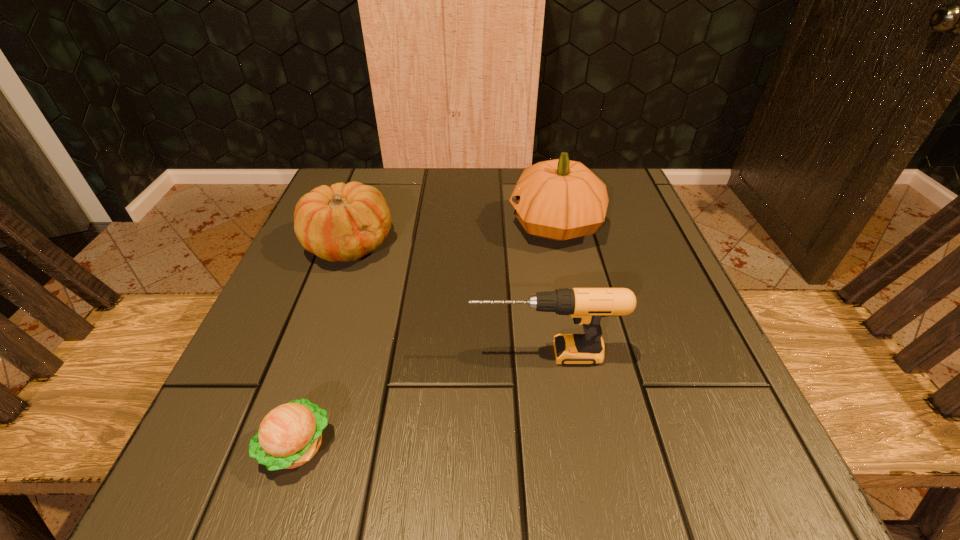
Image resolution: width=960 pixels, height=540 pixels. In order to click on free spot located on the side of the taller gourd with the carved face in this screenshot , I will do `click(443, 225)`.

At what (x,y) coordinates should I click in order to perform the action: click on vacant space positioned 0.060m on the handle side of the third shortest object. Please return your answer as a coordinate pair (x, y). Looking at the image, I should click on (432, 354).

In order to click on vacant space situated on the handle side of the third shortest object in this screenshot , I will do coord(252,354).

Where is `free space located 0.140m on the handle side of the third shortest object`? free space located 0.140m on the handle side of the third shortest object is located at coordinates (380, 354).

At what (x,y) coordinates should I click in order to perform the action: click on vacant region located on the right of the left gourd. Please return your answer as a coordinate pair (x, y). The image size is (960, 540). Looking at the image, I should click on (423, 245).

The width and height of the screenshot is (960, 540). I want to click on vacant space situated 0.340m on the right of the shortest object, so click(591, 446).

Locate an element on the screen. This screenshot has height=540, width=960. object located in the near edge section of the desktop is located at coordinates (290, 435).

At what (x,y) coordinates should I click in order to perform the action: click on gourd positioned at the left edge. Please return your answer as a coordinate pair (x, y). This screenshot has width=960, height=540. Looking at the image, I should click on (344, 222).

At what (x,y) coordinates should I click in order to perform the action: click on hamburger at the left edge. Please return your answer as a coordinate pair (x, y). Looking at the image, I should click on (290, 435).

Find the location of a particular element. The width and height of the screenshot is (960, 540). gourd that is positioned at the right edge is located at coordinates point(560,199).